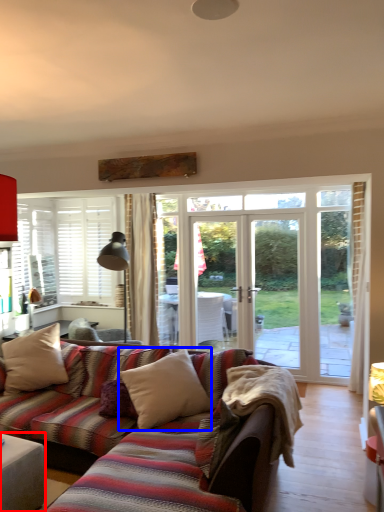
Question: Which object appears closest to the camera in this image, table (highlighted by a red box) or pillow (highlighted by a blue box)?

Choices:
 (A) table
 (B) pillow

Answer: (A)